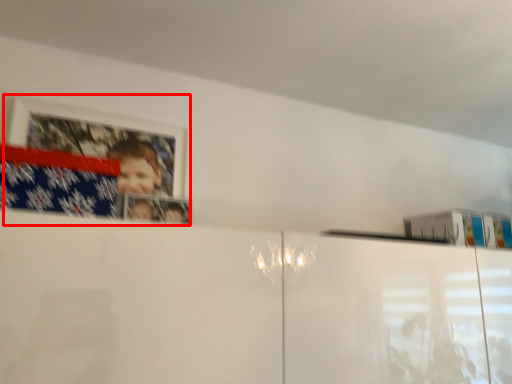
Question: From the image's perspective, what is the correct spatial positioning of picture frame (annotated by the red box) in reference to flag?

Choices:
 (A) below
 (B) above

Answer: (B)